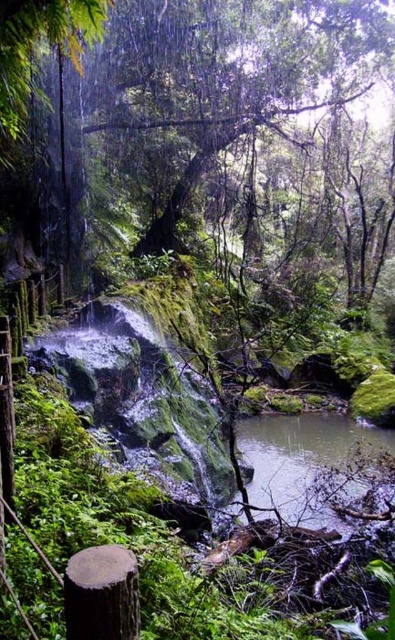
Is point (355, 477) less distant than point (67, 628)?

No, (355, 477) is behind (67, 628).

Who is more distant from viewer, (336, 477) or (135, 572)?

Positioned behind is point (336, 477).

Is point (278, 493) in front of point (99, 580)?

No.

Locate an element on the screen. green mossy stream at lower center is located at coordinates (304, 464).